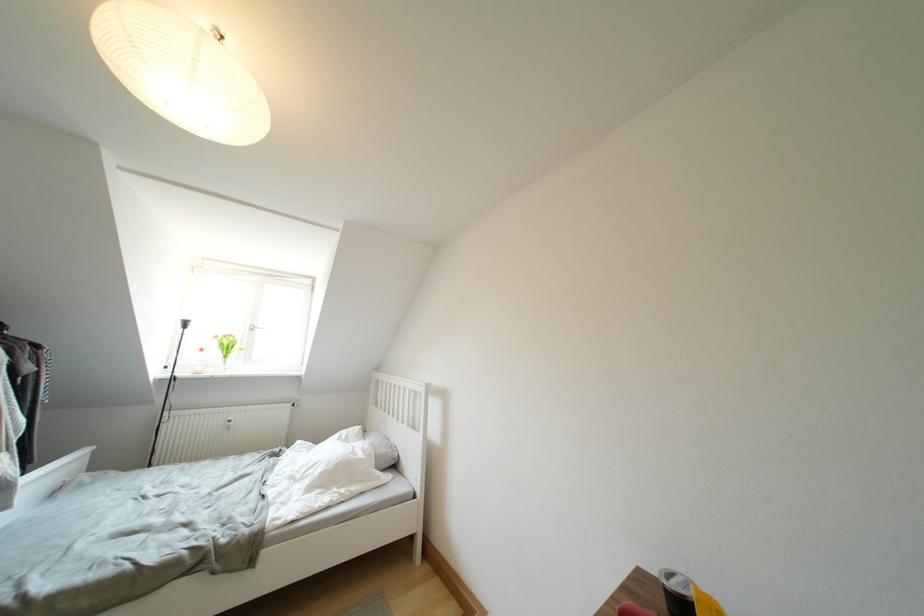
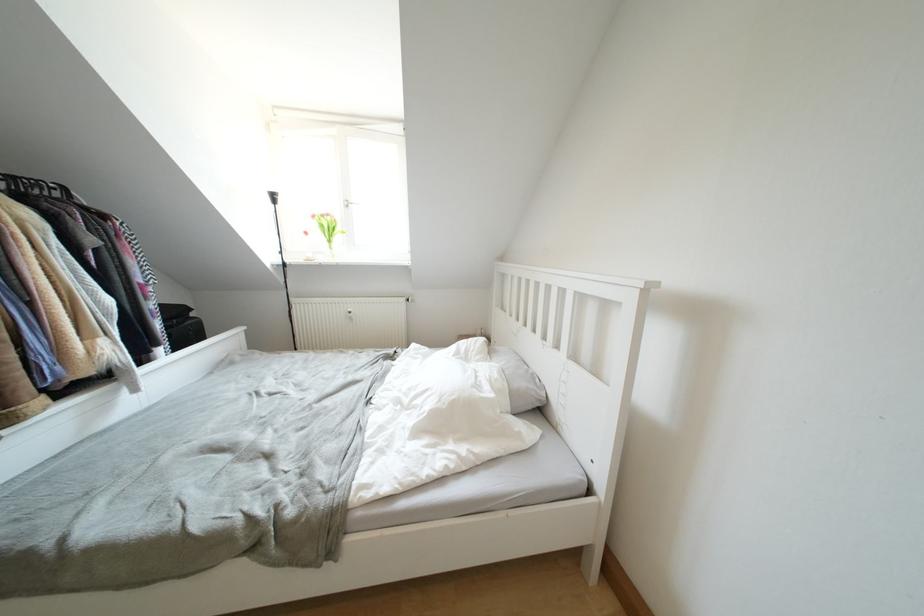
Locate, in the second image, the point that corresponds to [222,341] in the first image.

(319, 220)